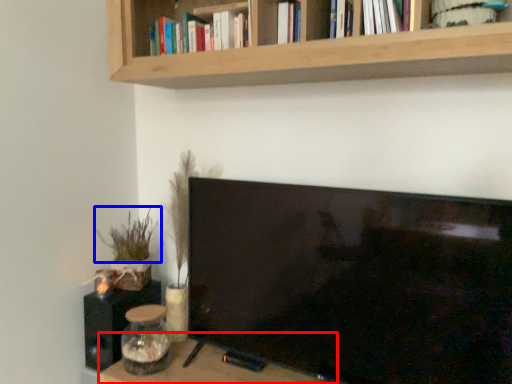
Question: Which point is further to the camera, table (highlighted by a red box) or plant (highlighted by a blue box)?

Choices:
 (A) table
 (B) plant

Answer: (B)